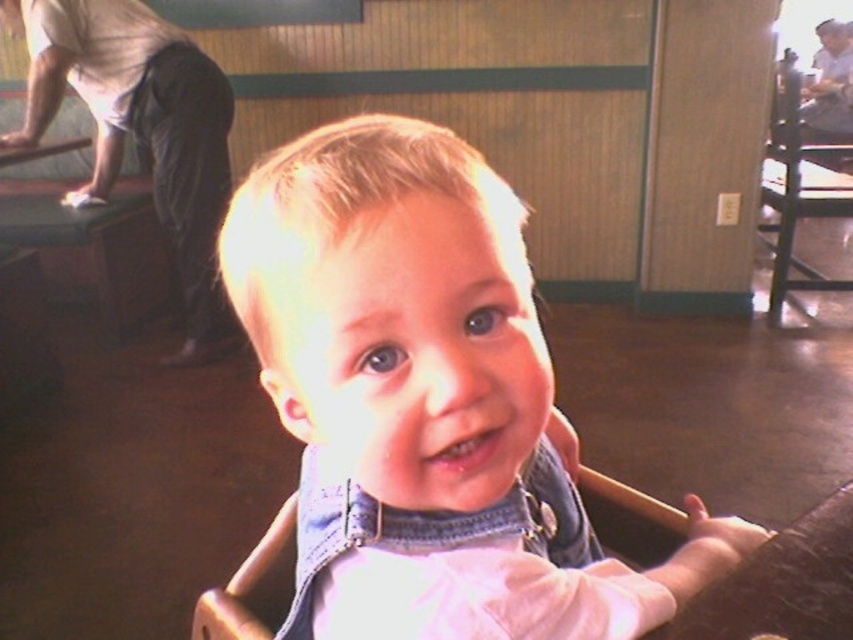
Question: Estimate the real-world distances between objects in this image. Which object is closer to the denim overalls at center?

Choices:
 (A) black wood chair at right
 (B) white matte baby at upper center

Answer: (B)

Question: Estimate the real-world distances between objects in this image. Which object is farther from the denim overalls at center?

Choices:
 (A) black wood chair at right
 (B) white matte baby at upper center

Answer: (A)

Question: Can you confirm if white matte baby at upper center is positioned to the right of black wood chair at right?

Choices:
 (A) yes
 (B) no

Answer: (B)

Question: Where is denim overalls at center located in relation to white matte baby at upper center in the image?

Choices:
 (A) above
 (B) below

Answer: (B)

Question: Observing the image, what is the correct spatial positioning of denim overalls at center in reference to white matte baby at upper center?

Choices:
 (A) right
 (B) left

Answer: (A)

Question: Which point is farther to the camera?

Choices:
 (A) (796, 132)
 (B) (355, 557)

Answer: (A)